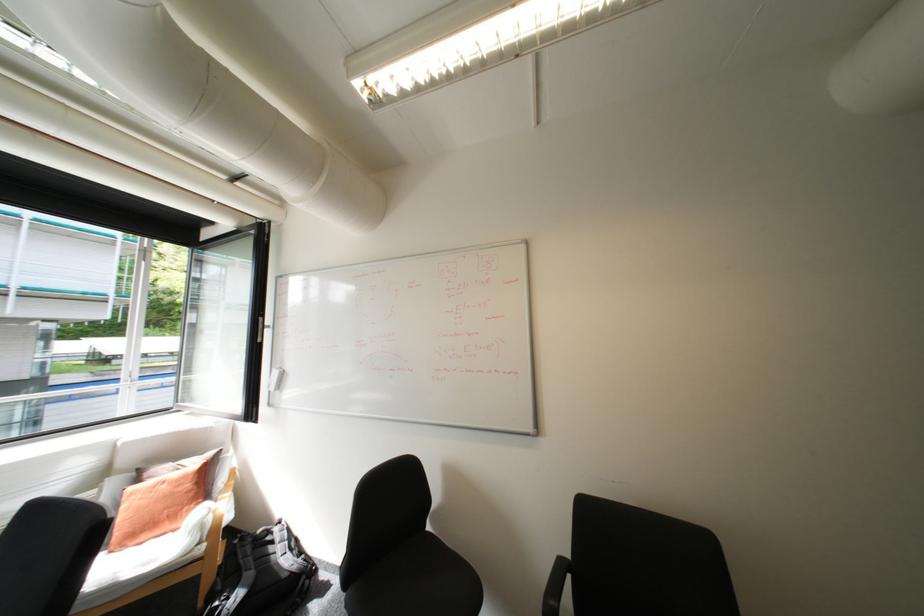
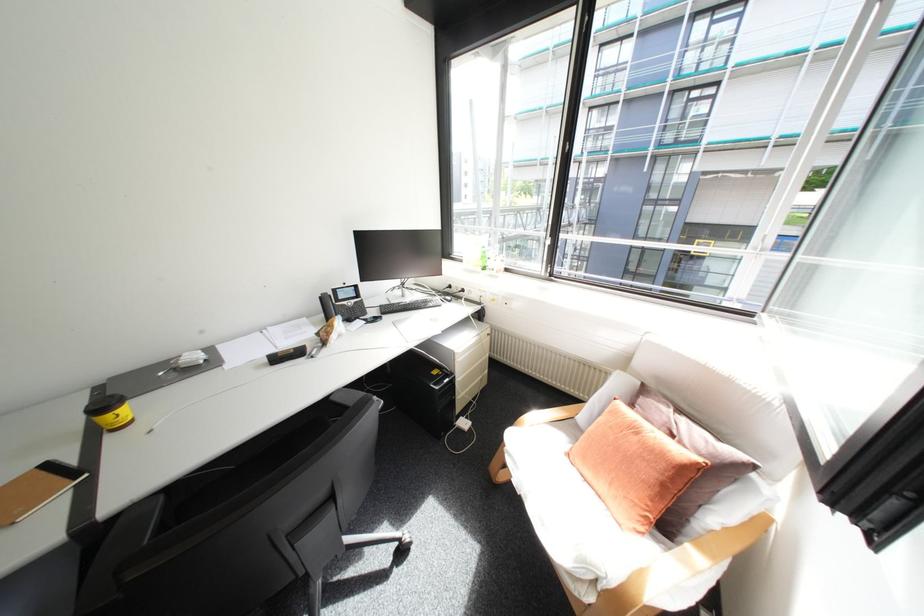
Locate, in the second image, the point that corresponds to [177,464] in the first image.

(677, 410)